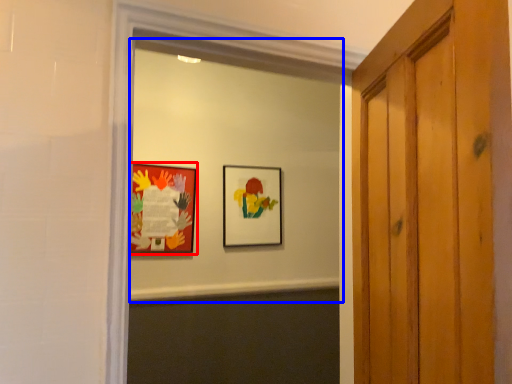
Question: Which object is further to the camera taking this photo, picture frame (highlighted by a red box) or mirror (highlighted by a blue box)?

Choices:
 (A) picture frame
 (B) mirror

Answer: (A)